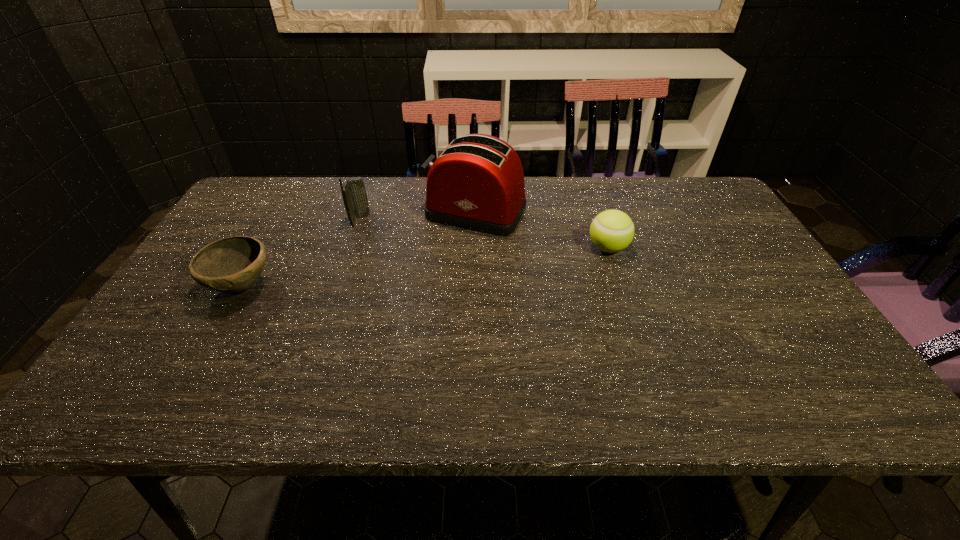
Locate an element on the screen. The height and width of the screenshot is (540, 960). free space located on the right of the bowl is located at coordinates (326, 286).

Image resolution: width=960 pixels, height=540 pixels. Find the location of `toaster positioned at the far edge`. toaster positioned at the far edge is located at coordinates (477, 183).

Locate an element on the screen. This screenshot has width=960, height=540. cellular telephone positioned at the far edge is located at coordinates (354, 195).

Image resolution: width=960 pixels, height=540 pixels. What are the coordinates of `object located in the left edge section of the desktop` in the screenshot? It's located at (233, 264).

In the image, there is a desktop. Find the location of `vacant space at the far edge`. vacant space at the far edge is located at coordinates (605, 188).

At what (x,y) coordinates should I click in order to perform the action: click on vacant space at the near edge. Please return your answer as a coordinate pair (x, y). This screenshot has height=540, width=960. Looking at the image, I should click on (298, 396).

In the image, there is a desktop. Identify the location of blank space at the left edge. (272, 225).

The height and width of the screenshot is (540, 960). Identify the location of free region at the right edge of the desktop. click(817, 340).

Where is `free space at the far left corner`? This screenshot has width=960, height=540. free space at the far left corner is located at coordinates (286, 205).

I want to click on free space at the far right corner of the desktop, so click(x=715, y=195).